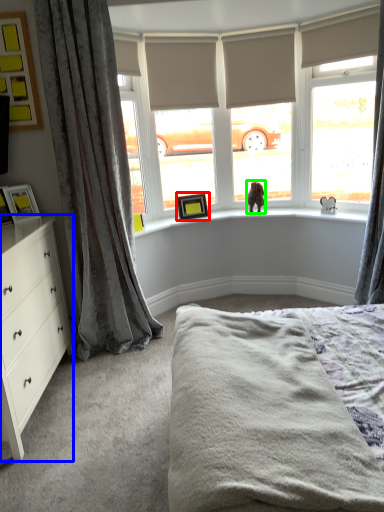
Question: Which object is positioned closest to picture frame (highlighted by a red box)? Select from chest of drawers (highlighted by a blue box) and animal (highlighted by a green box).

Choices:
 (A) chest of drawers
 (B) animal

Answer: (B)